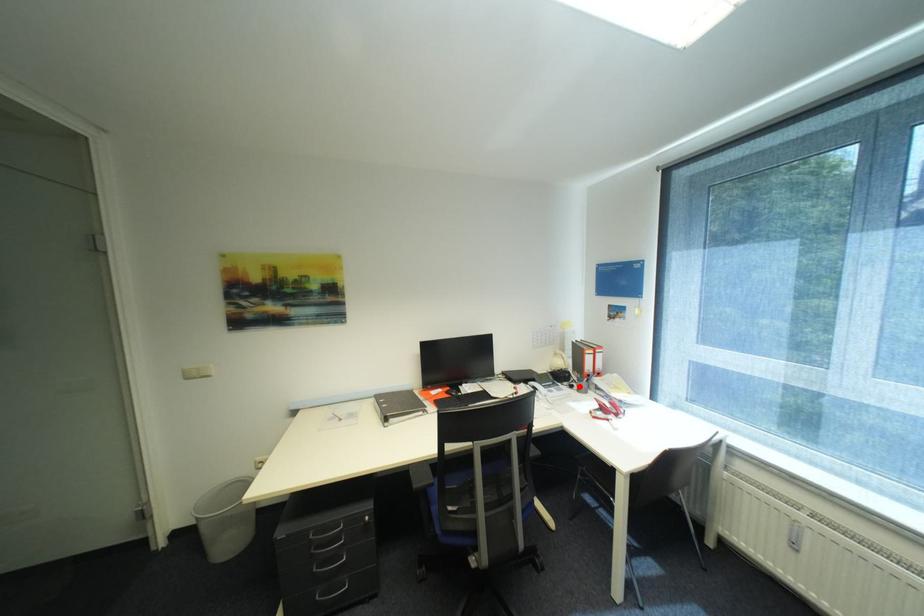
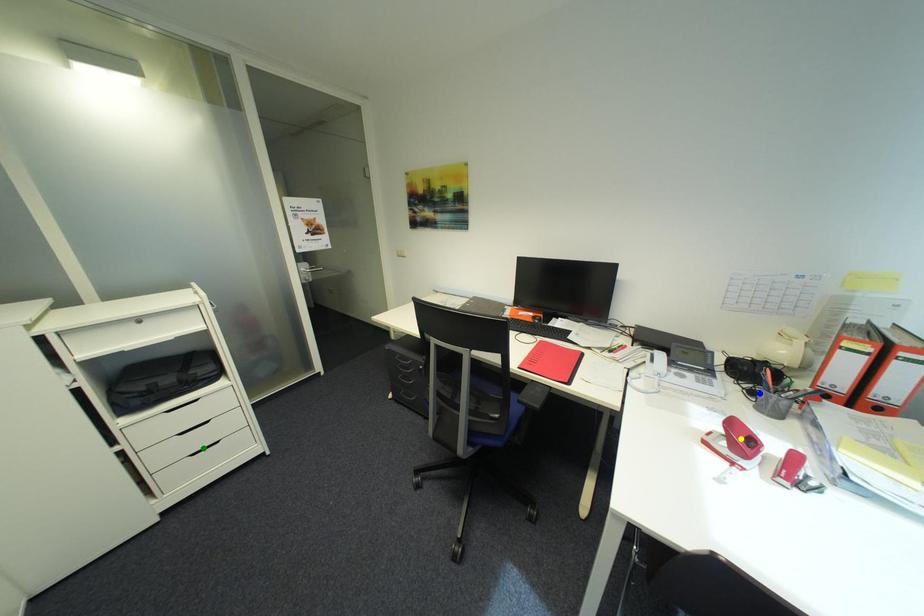
Question: I am providing you with two images of the same scene from different viewpoints. A red point is marked on the first image. You are given multiple points on the second image. Which point in image 2 is actually the same real-world point as the red point in image 1?

Choices:
 (A) yellow point
 (B) green point
 (C) blue point

Answer: (C)